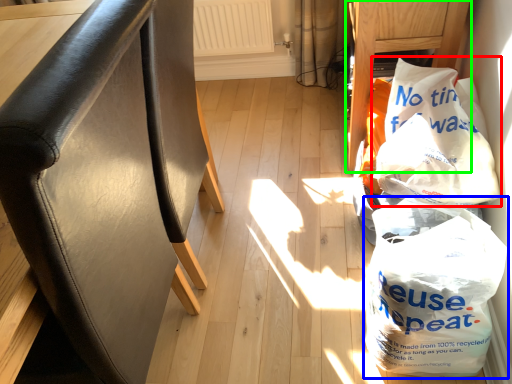
Question: Based on their relative distances, which object is nearer to plastic bag (highlighted by a red box)? Choose from plastic bag (highlighted by a blue box) and furniture (highlighted by a green box).

Choices:
 (A) plastic bag
 (B) furniture

Answer: (A)